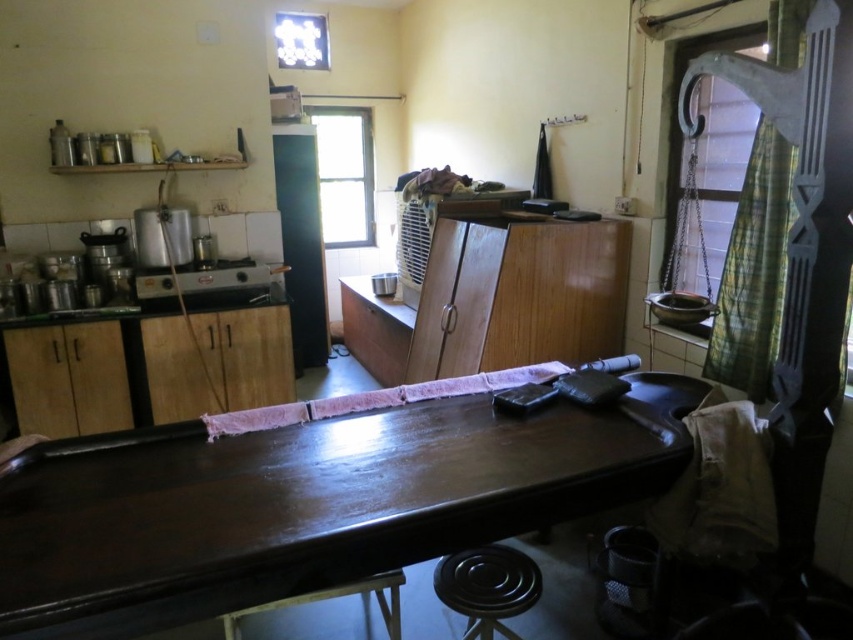
Question: Which point is farther to the camera?

Choices:
 (A) (444, 584)
 (B) (183, 269)
 (C) (395, 600)
 (D) (496, 484)

Answer: (B)

Question: Where is black rubber stool at lower center located in relation to metallic silver toaster at left in the image?

Choices:
 (A) above
 (B) below

Answer: (B)

Question: Is black rubber stool at lower center wider than wooden stool at lower center?

Choices:
 (A) no
 (B) yes

Answer: (A)

Question: Which object is farther from the camera taking this photo?

Choices:
 (A) black rubber stool at lower center
 (B) wooden stool at lower center
 (C) glossy wood table at center

Answer: (A)

Question: Estimate the real-world distances between objects in this image. Which object is closer to the black rubber stool at lower center?

Choices:
 (A) glossy wood table at center
 (B) metallic silver toaster at left
 (C) wooden stool at lower center

Answer: (C)

Question: Does black rubber stool at lower center come in front of wooden stool at lower center?

Choices:
 (A) no
 (B) yes

Answer: (A)